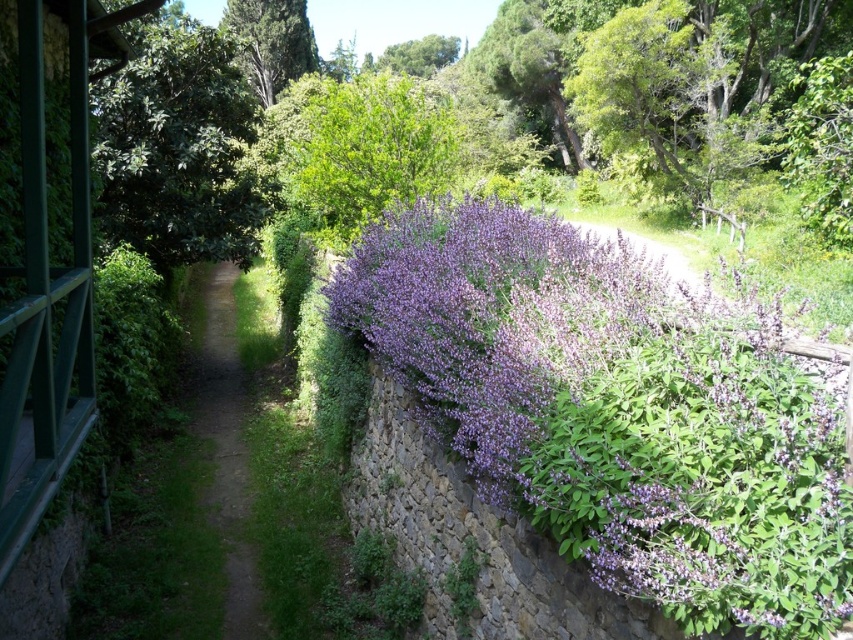
You are a gardener planning to plant a new flower bed between the purple leafy bush at center and the green leafy tree at upper left. Which direction should you walk from the tree to reach the bush?

To reach the purple leafy bush at center from the green leafy tree at upper left, you should walk to the right since the purple leafy bush at center is positioned to the right of the green leafy tree at upper left.

You are a landscape architect designing a new garden layout. You need to place a small bench between the green leafy tree at upper left and the green textured tree at upper center. Based on their widths, which tree should the bench be closer to?

The bench should be placed closer to the green leafy tree at upper left because it has a lesser width compared to the green textured tree at upper center, allowing more space around the wider tree.

You are standing at the center of the dirt path in the garden scene. Which direction should you look to see the green leafy tree at upper left?

The green leafy tree at upper left is located at point (178, 147), which means it is positioned towards the upper left direction from your current position at the center of the dirt path.